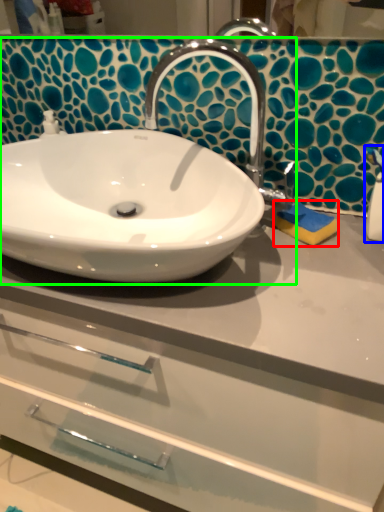
Question: Which object is the farthest from soap (highlighted by a red box)? Choose among these: soap dispenser (highlighted by a blue box) or sink (highlighted by a green box).

Choices:
 (A) soap dispenser
 (B) sink

Answer: (B)